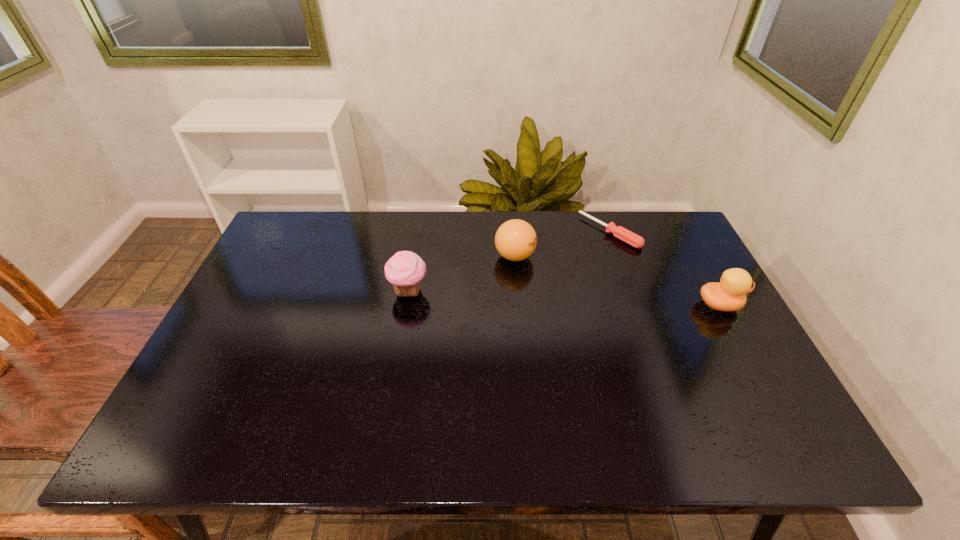
The width and height of the screenshot is (960, 540). Find the location of `vacant space on the desktop that is between the cupcake and the rightmost object and is positioned on the side with brand of the ping-pong ball`. vacant space on the desktop that is between the cupcake and the rightmost object and is positioned on the side with brand of the ping-pong ball is located at coordinates (586, 299).

Locate an element on the screen. The image size is (960, 540). free space on the desktop that is between the cupcake and the rightmost object and is positioned at the tip of the screwdriver is located at coordinates (517, 296).